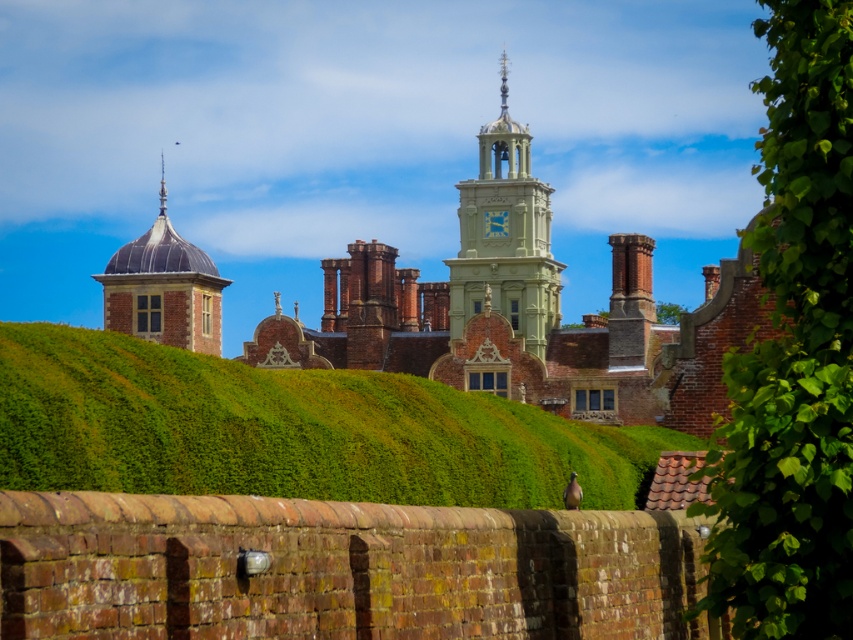
You are a gardener tasked with maintaining the green hedge at center and the green stone clock tower at center. Which of the two requires more frequent trimming to maintain its current size?

The green hedge at center requires more frequent trimming since it is bigger than the green stone clock tower at center, which is a nonliving structure and does not grow.

You are a landscape architect planning to install a new pathway between the green leafy hedge at right and the smooth gray dome at upper left. Given that the pathway must be at least 50 meters long to accommodate the design, will the available space between them suffice?

The distance between the green leafy hedge at right and the smooth gray dome at upper left is 70.89 meters, which exceeds the required 50 meters. Therefore, the available space is sufficient for the pathway.

You are a landscape architect designing a garden layout. You have to place a new statue that requires a base area of 2 square meters. Given the green hedge at center and the smooth gray dome at upper left, which object can accommodate the statue based on their sizes?

The green hedge at center is larger in size than the smooth gray dome at upper left, so the green hedge at center can accommodate the statue as it has a larger base area.